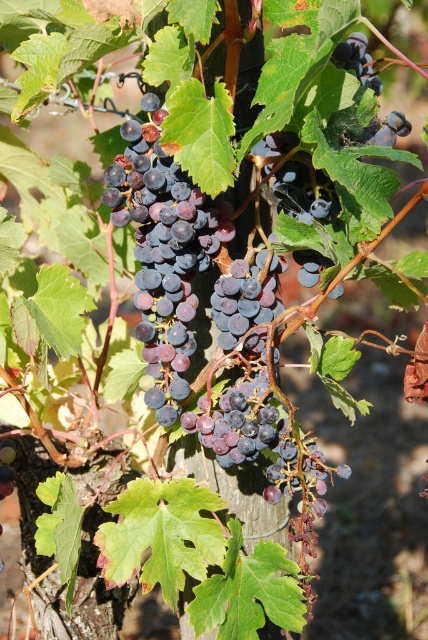
Which is in front, point (119, 186) or point (0, 464)?

Point (119, 186) is more forward.

Can you confirm if dark purple grapes at center is positioned below shiny purple grapes at center?

Actually, dark purple grapes at center is above shiny purple grapes at center.

Find the location of a particular element. The image size is (428, 640). dark purple grapes at center is located at coordinates (163, 252).

Identify the location of dark purple grapes at center. (163, 252).